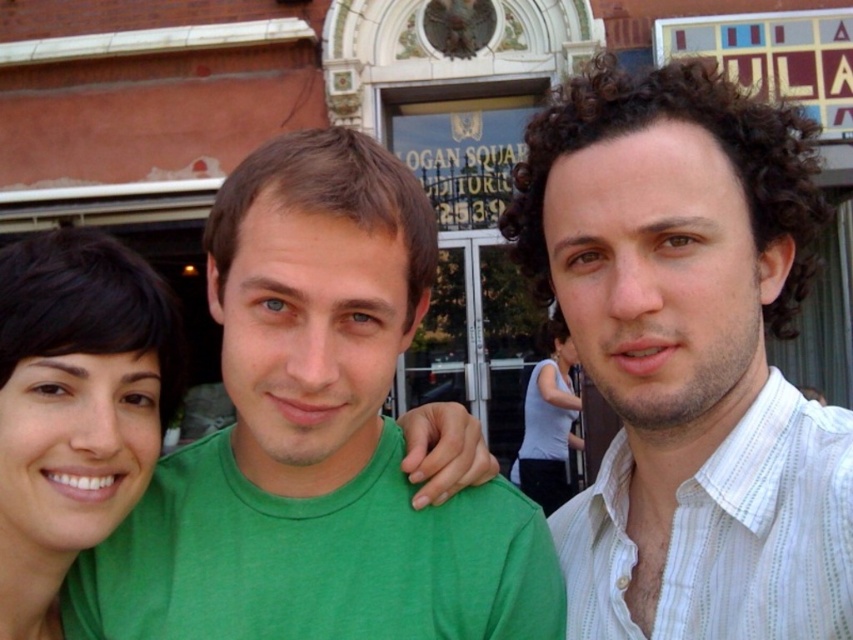
Question: Which of the following is the closest to the observer?

Choices:
 (A) (804, 419)
 (B) (287, 160)
 (C) (556, 472)
 (D) (717, 609)

Answer: (D)

Question: Can you confirm if white striped shirt at right is positioned to the left of white matte tank top at center?

Choices:
 (A) no
 (B) yes

Answer: (A)

Question: Which object is the closest to the green matte shirt at center?

Choices:
 (A) white striped shirt at right
 (B) white matte tank top at center
 (C) white striped shirt at center
 (D) matte green shirt at left

Answer: (D)

Question: From the image, what is the correct spatial relationship of white striped shirt at center in relation to green matte shirt at center?

Choices:
 (A) below
 (B) above

Answer: (B)

Question: Which object is the closest to the matte green shirt at left?

Choices:
 (A) green matte shirt at center
 (B) white striped shirt at right

Answer: (A)

Question: Can you confirm if white striped shirt at center is bigger than white matte tank top at center?

Choices:
 (A) yes
 (B) no

Answer: (A)